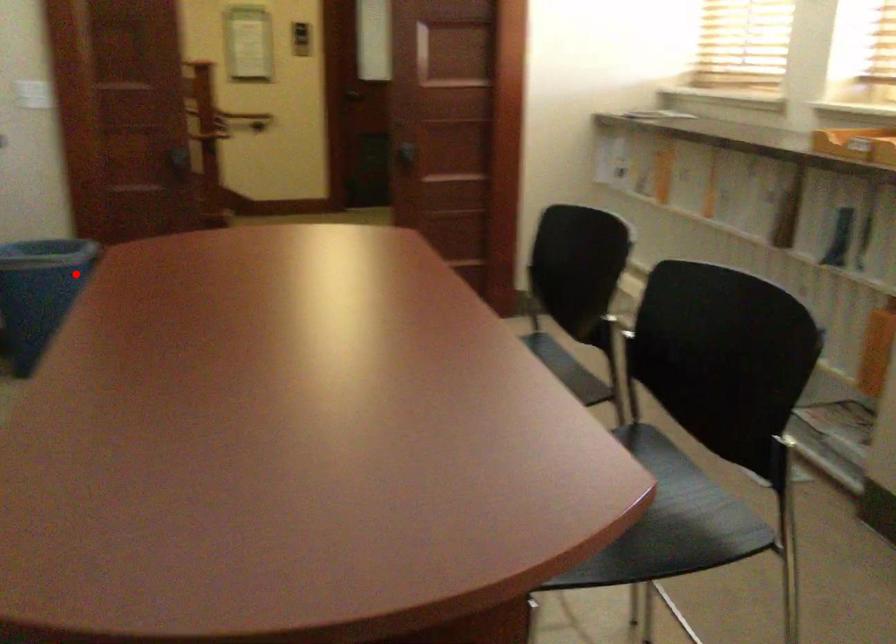
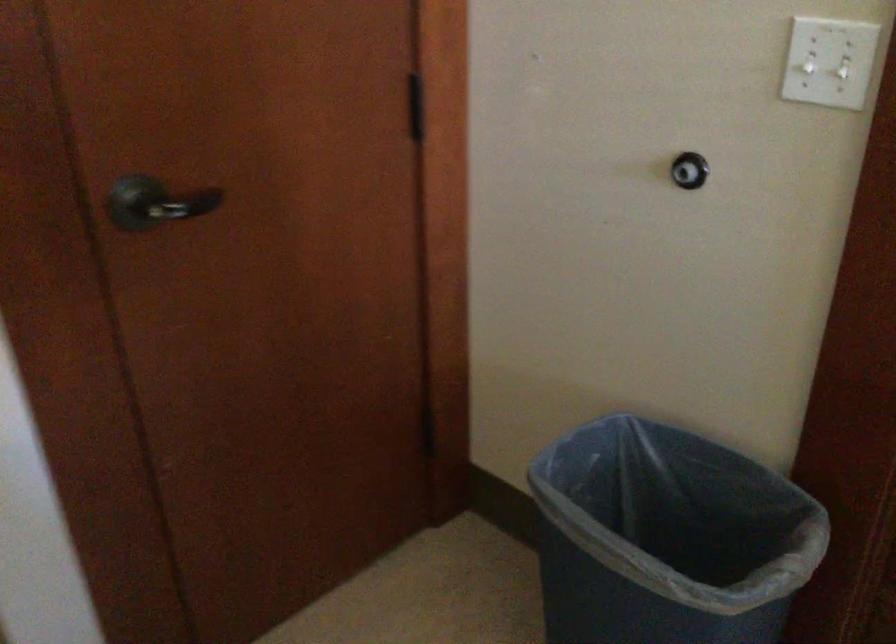
Locate, in the second image, the point that corresponds to the highlighted location in the first image.

(667, 538)